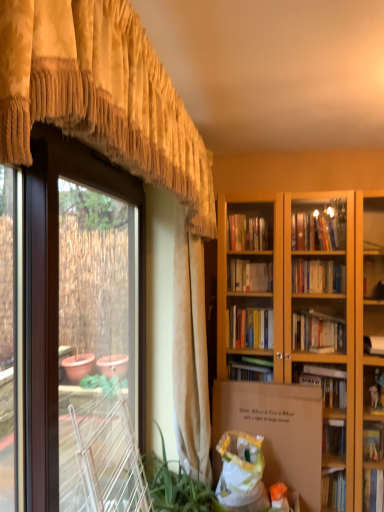
Question: Is point pyautogui.click(x=185, y=439) positioned closer to the camera than point pyautogui.click(x=281, y=425)?

Choices:
 (A) farther
 (B) closer

Answer: (B)

Question: From a real-world perspective, is gold textured valance at center, the 1th curtain positioned from the back, physically located above or below white cardboard box at center?

Choices:
 (A) above
 (B) below

Answer: (A)

Question: Which object is the farthest from the green leafy plant at lower left?

Choices:
 (A) gold textured valance at upper left, the 1th curtain in the front-to-back sequence
 (B) gold textured valance at center, the 1th curtain positioned from the back
 (C) brown matte screen door at left
 (D) white plastic bag at lower center
 (E) white cardboard box at center

Answer: (A)

Question: Which object is positioned farthest from the white cardboard box at center?

Choices:
 (A) brown matte screen door at left
 (B) gold textured valance at center, the 1th curtain positioned from the back
 (C) white plastic bag at lower center
 (D) green leafy plant at lower left
 (E) gold textured valance at upper left, the 1th curtain in the front-to-back sequence

Answer: (A)